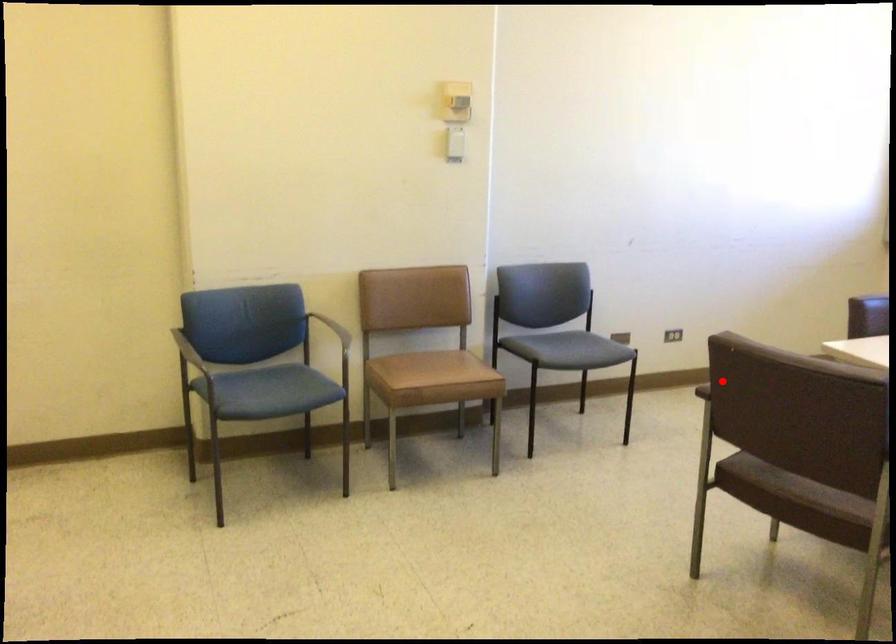
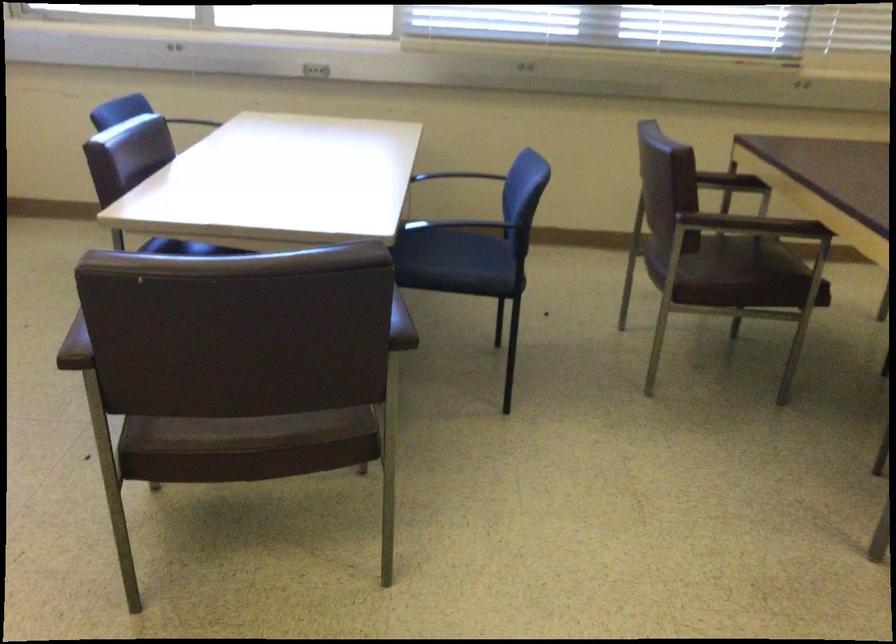
Question: I am providing you with two images of the same scene from different viewpoints. A red point is marked on the first image. Can you still see the location of the red point in image 2?

Choices:
 (A) Yes
 (B) No

Answer: (A)